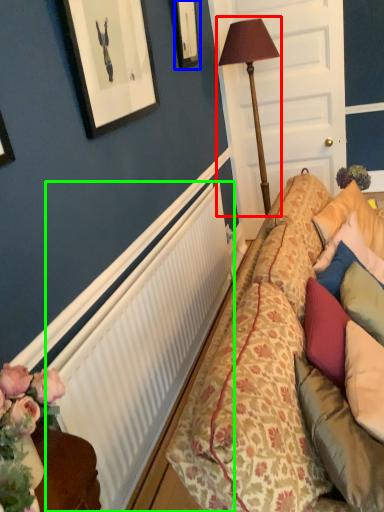
Question: Which is farther away from table lamp (highlighted by a red box)? picture frame (highlighted by a blue box) or radiator (highlighted by a green box)?

Choices:
 (A) picture frame
 (B) radiator

Answer: (B)